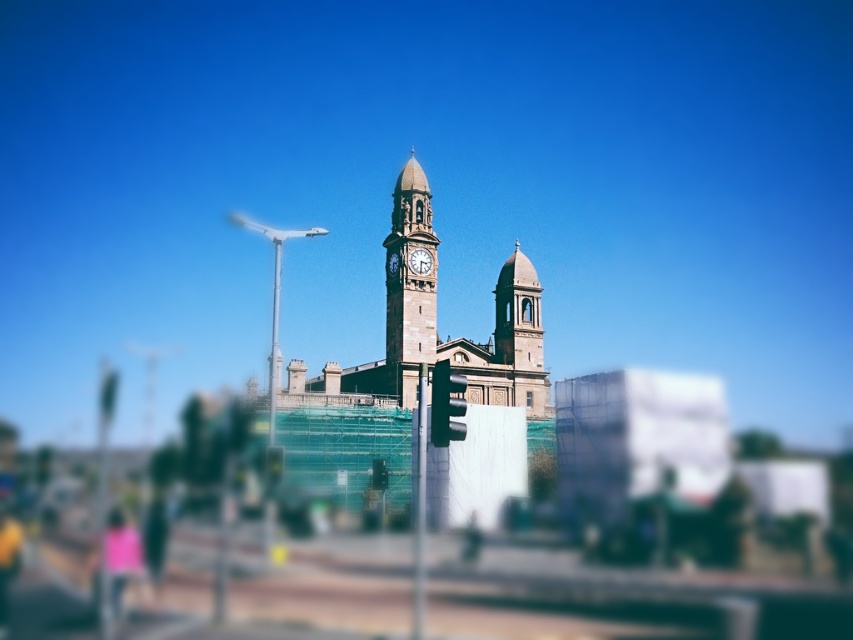
Based on the photo, you are a delivery drone that needs to land between the white stone clock at center and the green metallic clock tower at center. The minimum safe distance required for landing is 10 feet. Can you safely land in that space?

The white stone clock at center and green metallic clock tower at center are 10.65 feet apart from each other. Since the required minimum safe distance is 10 feet, the drone can safely land between them as the available space exceeds the required distance.

You are a city planner assessing the historic clock tower structure. You notice two towers at the center. Which tower has a smaller width between the stone clock tower at center and the smooth stone tower at center?

The stone clock tower at center has a lesser width compared to the smooth stone tower at center, so the stone clock tower at center is narrower.